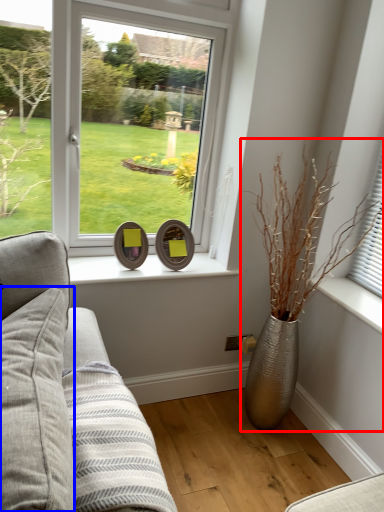
Question: Which point is closer to the camera, houseplant (highlighted by a red box) or pillow (highlighted by a blue box)?

Choices:
 (A) houseplant
 (B) pillow

Answer: (B)